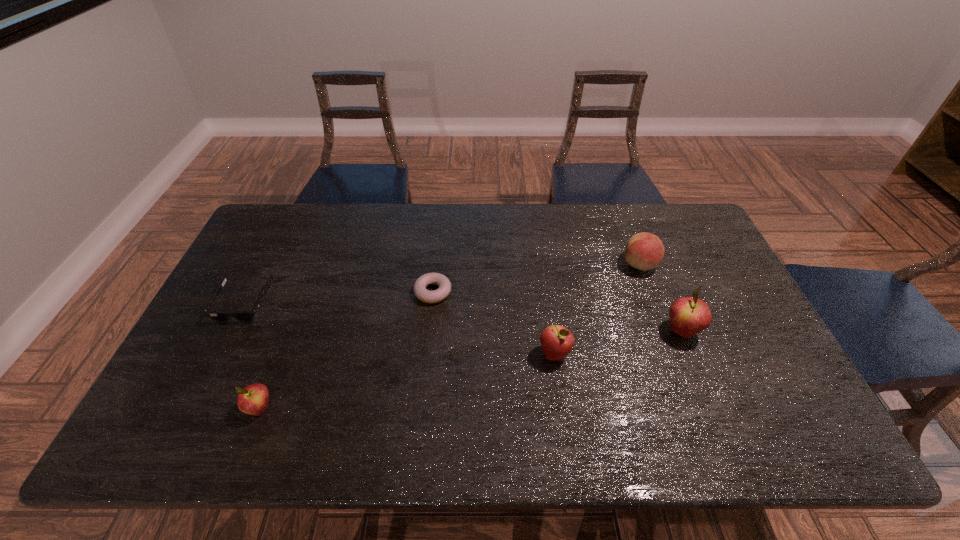
The height and width of the screenshot is (540, 960). I want to click on free point between the peach and the rightmost apple, so tap(660, 298).

At what (x,y) coordinates should I click in order to perform the action: click on free space between the sunglasses and the tallest object. Please return your answer as a coordinate pair (x, y). This screenshot has width=960, height=540. Looking at the image, I should click on (463, 317).

Image resolution: width=960 pixels, height=540 pixels. In order to click on free space that is in between the rightmost apple and the farthest object in this screenshot , I will do `click(660, 298)`.

Locate an element on the screen. The height and width of the screenshot is (540, 960). vacant area that lies between the tallest apple and the nearest object is located at coordinates (470, 370).

At what (x,y) coordinates should I click in order to perform the action: click on free space between the nearest object and the fourth object from left to right. Please return your answer as a coordinate pair (x, y). The height and width of the screenshot is (540, 960). Looking at the image, I should click on (407, 381).

Locate an element on the screen. Image resolution: width=960 pixels, height=540 pixels. the fourth closest object to the tallest apple is located at coordinates (253, 399).

Identify which object is the closest to the peach. Please provide its 2D coordinates. Your answer should be formatted as a tuple, i.e. [(x, y)], where the tuple contains the x and y coordinates of a point satisfying the conditions above.

[(688, 315)]

Select which apple appears as the third closest to the sunglasses. Please provide its 2D coordinates. Your answer should be formatted as a tuple, i.e. [(x, y)], where the tuple contains the x and y coordinates of a point satisfying the conditions above.

[(688, 315)]

Point out which apple is positioned as the second nearest to the second apple from right to left. Please provide its 2D coordinates. Your answer should be formatted as a tuple, i.e. [(x, y)], where the tuple contains the x and y coordinates of a point satisfying the conditions above.

[(253, 399)]

Identify the location of blank area in the image that satisfies the following two spatial constraints: 1. on the back side of the second apple from right to left; 2. on the left side of the nearest apple. (280, 354).